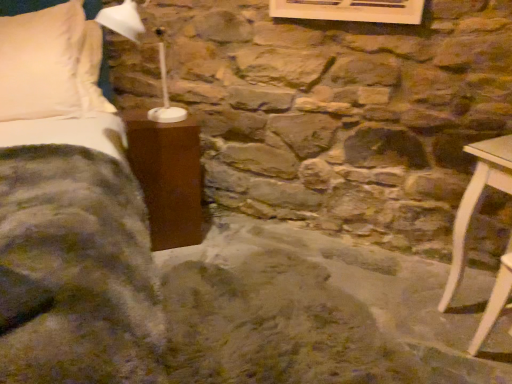
Question: Is velvet green blanket at left to the right of white plastic table lamp at upper left from the viewer's perspective?

Choices:
 (A) yes
 (B) no

Answer: (A)

Question: Is velvet green blanket at left touching white plastic table lamp at upper left?

Choices:
 (A) yes
 (B) no

Answer: (B)

Question: Can you confirm if velvet green blanket at left is bigger than white plastic table lamp at upper left?

Choices:
 (A) no
 (B) yes

Answer: (B)

Question: Is velvet green blanket at left not within white plastic table lamp at upper left?

Choices:
 (A) yes
 (B) no

Answer: (A)

Question: Are velvet green blanket at left and white plastic table lamp at upper left far apart?

Choices:
 (A) yes
 (B) no

Answer: (B)

Question: Relative to velvet green blanket at left, is white plastic table lamp at upper left in front or behind?

Choices:
 (A) front
 (B) behind

Answer: (B)

Question: From the image's perspective, is white plastic table lamp at upper left located above or below velvet green blanket at left?

Choices:
 (A) below
 (B) above

Answer: (B)

Question: From a real-world perspective, is white plastic table lamp at upper left above or below velvet green blanket at left?

Choices:
 (A) below
 (B) above

Answer: (B)

Question: Considering the positions of white plastic table lamp at upper left and velvet green blanket at left in the image, is white plastic table lamp at upper left wider or thinner than velvet green blanket at left?

Choices:
 (A) thin
 (B) wide

Answer: (A)

Question: Considering the positions of velvet green blanket at left and white plastic table lamp at upper left in the image, is velvet green blanket at left taller or shorter than white plastic table lamp at upper left?

Choices:
 (A) short
 (B) tall

Answer: (B)

Question: In the image, is velvet green blanket at left positioned in front of or behind white plastic table lamp at upper left?

Choices:
 (A) front
 (B) behind

Answer: (A)

Question: Is point (80, 127) positioned closer to the camera than point (155, 29)?

Choices:
 (A) farther
 (B) closer

Answer: (B)

Question: Considering the positions of velvet green blanket at left and white plastic table lamp at upper left in the image, is velvet green blanket at left wider or thinner than white plastic table lamp at upper left?

Choices:
 (A) thin
 (B) wide

Answer: (B)

Question: In terms of height, does white wood chair at lower right, the 2th furniture in the top-to-bottom sequence, look taller or shorter compared to matte brown nightstand at left, which appears as the 1th furniture when viewed from the back?

Choices:
 (A) short
 (B) tall

Answer: (A)

Question: From a real-world perspective, is white wood chair at lower right, the second furniture viewed from the left, above or below matte brown nightstand at left, placed as the 2th furniture when sorted from bottom to top?

Choices:
 (A) below
 (B) above

Answer: (A)